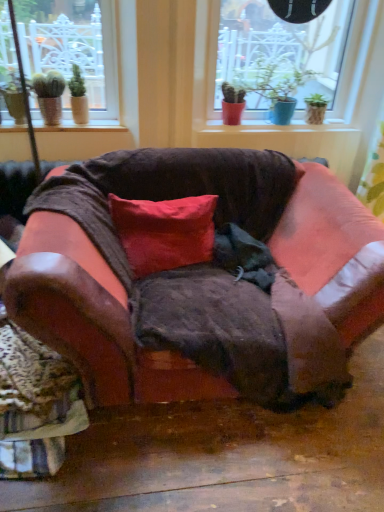
Identify the location of free spot above smooth wood window sill at upper left, the 1th window sill in the left-to-right sequence (from a real-world perspective). (75, 121).